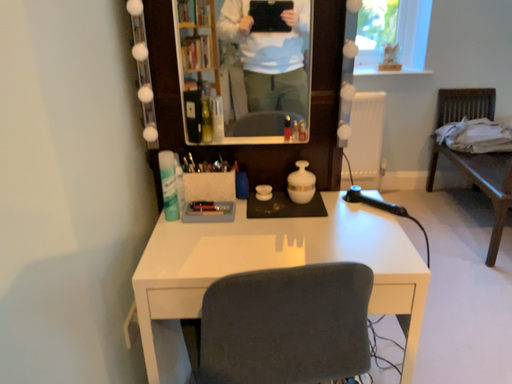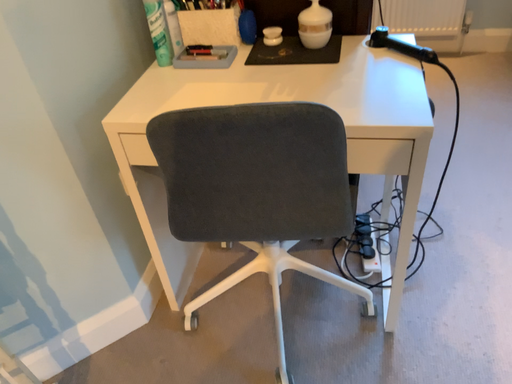
Question: How did the camera likely rotate when shooting the video?

Choices:
 (A) rotated upward
 (B) rotated downward

Answer: (B)